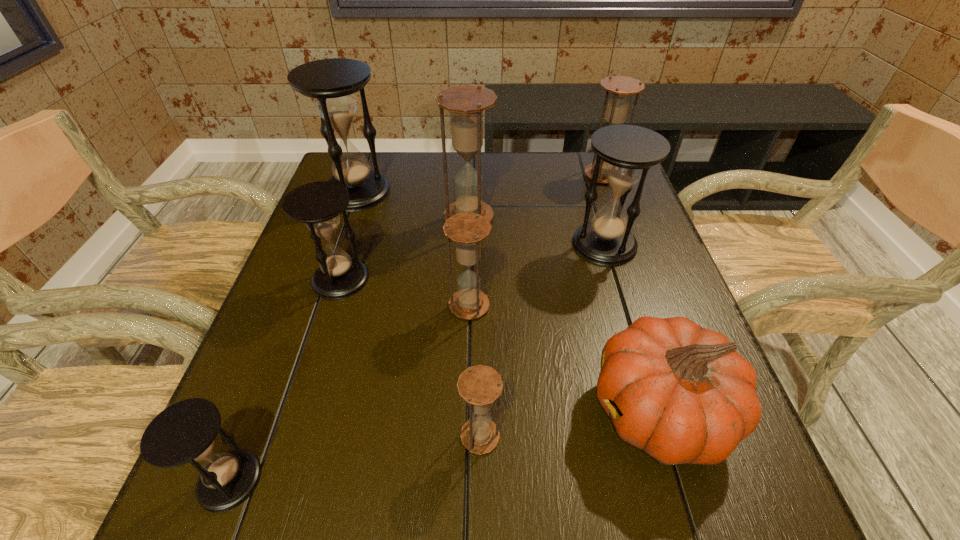
Where is `free space that satisfies the following two spatial constraints: 1. on the back side of the smallest black hourglass; 2. on the right side of the farthest brown hourglass`? free space that satisfies the following two spatial constraints: 1. on the back side of the smallest black hourglass; 2. on the right side of the farthest brown hourglass is located at coordinates (348, 175).

At what (x,y) coordinates should I click in order to perform the action: click on vacant space that satisfies the following two spatial constraints: 1. on the back side of the smallest black hourglass; 2. on the right side of the third biggest black hourglass. Please return your answer as a coordinate pair (x, y). This screenshot has width=960, height=540. Looking at the image, I should click on tap(307, 279).